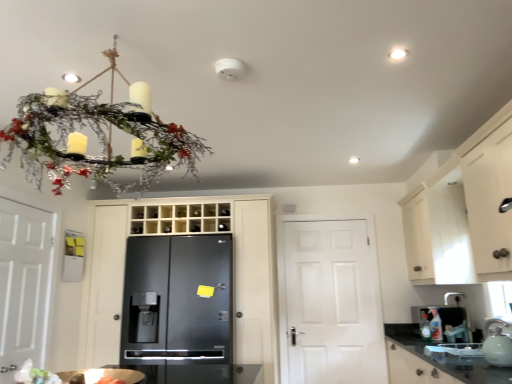
Question: In terms of width, does white glossy tea pot at lower right look wider or thinner when compared to glossy black refrigerator at center, the second door when ordered from right to left?

Choices:
 (A) thin
 (B) wide

Answer: (A)

Question: Considering their positions, is white glossy tea pot at lower right located in front of or behind glossy black refrigerator at center, marked as the second door in a left-to-right arrangement?

Choices:
 (A) behind
 (B) front

Answer: (B)

Question: Which is nearer to the black matte refrigerator at center?

Choices:
 (A) white matte door at center, marked as the 3th door in a left-to-right arrangement
 (B) white matte door at left, which is counted as the 3th door, starting from the right
 (C) glossy black refrigerator at center, the second door when ordered from right to left
 (D) black granite countertop at lower right
 (E) white wood cabinet at upper right

Answer: (C)

Question: Which object is the farthest from the white wood cabinet at upper right?

Choices:
 (A) white matte door at center, marked as the 3th door in a left-to-right arrangement
 (B) white matte door at left, which is the first door in left-to-right order
 (C) black matte refrigerator at center
 (D) black granite countertop at lower right
 (E) white glossy tea pot at lower right

Answer: (B)